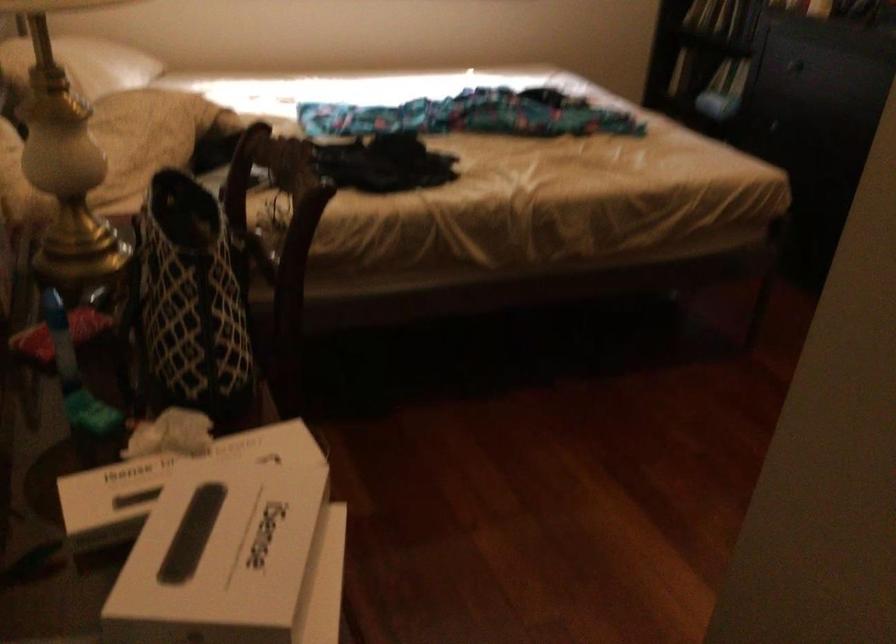
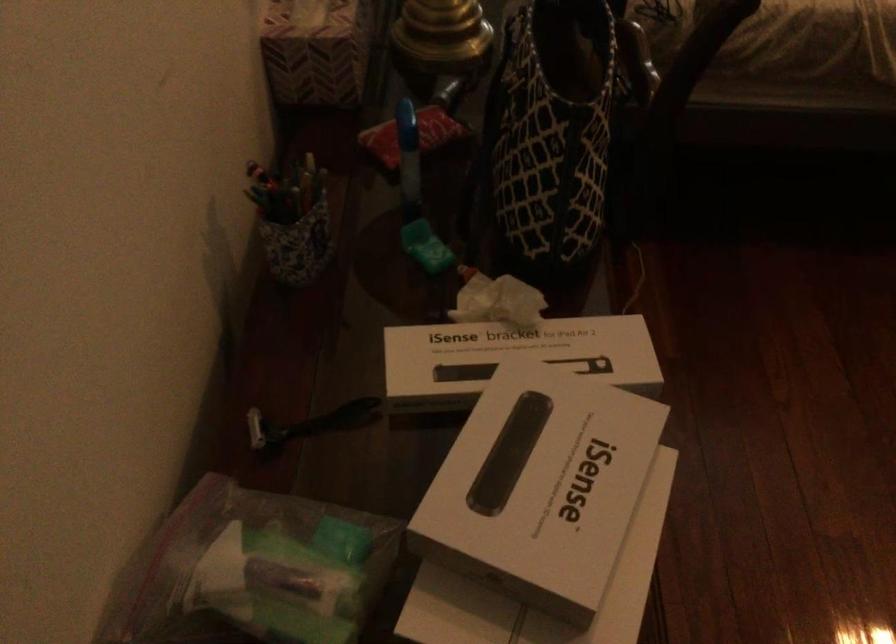
Where in the second image is the point corresponding to (x=231, y=549) from the first image?

(540, 486)